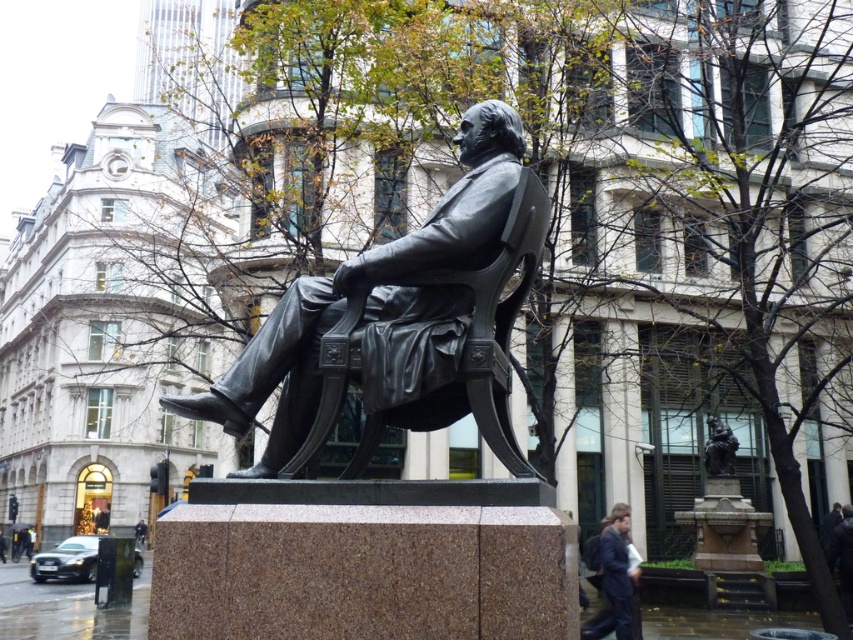
Can you confirm if dark blue suit at lower right is shorter than bronze statue at center?

Yes.

Is dark blue suit at lower right further to camera compared to bronze statue at center?

No, dark blue suit at lower right is closer to the viewer.

Identify the location of dark blue suit at lower right. (614, 579).

Based on the photo, does polished bronze statue at center appear on the right side of dark blue suit at lower right?

Incorrect, polished bronze statue at center is not on the right side of dark blue suit at lower right.

Is point (508, 221) positioned in front of point (610, 588)?

Yes, point (508, 221) is closer to viewer.

Is point (518, 186) more distant than point (631, 589)?

No, it is not.

Image resolution: width=853 pixels, height=640 pixels. Identify the location of polished bronze statue at center. (398, 321).

Is polished bronze statue at center bigger than bronze statue at center?

Yes, polished bronze statue at center is bigger than bronze statue at center.

Which is in front, point (520, 180) or point (726, 429)?

Point (520, 180)

Is point (397, 369) behind point (704, 461)?

No, it is not.

This screenshot has width=853, height=640. I want to click on polished bronze statue at center, so (398, 321).